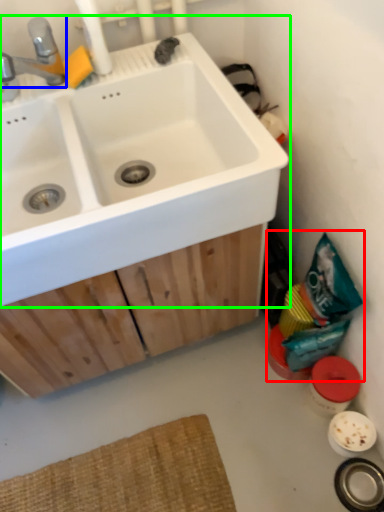
Question: Which object is positioned farthest from garbage (highlighted by a red box)? Select from tap (highlighted by a blue box) and sink (highlighted by a green box).

Choices:
 (A) tap
 (B) sink

Answer: (A)